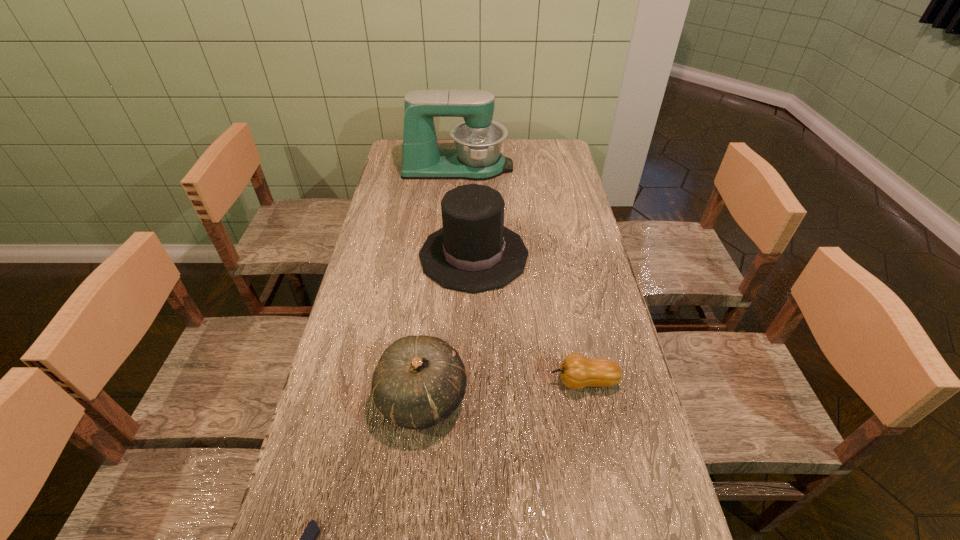
Identify the location of the tallest object. The image size is (960, 540). (478, 140).

Find the location of `the farthest object`. the farthest object is located at coordinates (478, 140).

The image size is (960, 540). What are the coordinates of `the fourth nearest object` in the screenshot? It's located at [x=473, y=252].

Locate an element on the screen. This screenshot has height=540, width=960. dress hat is located at coordinates (473, 252).

Find the location of a particular element. the left gourd is located at coordinates (419, 381).

At what (x,y) coordinates should I click in order to perform the action: click on the taller gourd. Please return your answer as a coordinate pair (x, y). Looking at the image, I should click on (419, 381).

Image resolution: width=960 pixels, height=540 pixels. What are the coordinates of `the rightmost object` in the screenshot? It's located at (576, 371).

Locate an element on the screen. the fourth tallest object is located at coordinates (576, 371).

Where is `vacant space situated 0.130m on the front-facing side of the mixer`? vacant space situated 0.130m on the front-facing side of the mixer is located at coordinates (545, 167).

Identify the location of free location located on the front of the dress hat with the decoration. The image size is (960, 540). (569, 255).